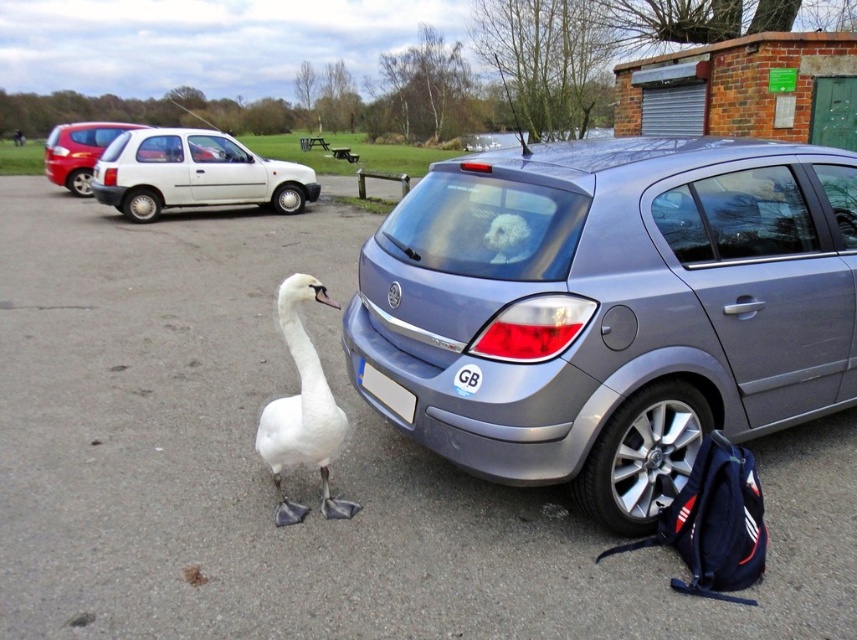
Question: Observing the image, what is the correct spatial positioning of matte red hatchback at left in reference to white plastic license plate at rear?

Choices:
 (A) left
 (B) right

Answer: (A)

Question: Is satin silver car at center thinner than matte red hatchback at left?

Choices:
 (A) yes
 (B) no

Answer: (A)

Question: Which point appears closest to the camera in this image?

Choices:
 (A) (120, 124)
 (B) (682, 289)

Answer: (B)

Question: Among these points, which one is farthest from the camera?

Choices:
 (A) (388, 396)
 (B) (838, 337)
 (C) (280, 435)
 (D) (165, 189)

Answer: (D)

Question: Does white matte hatchback at left appear on the left side of white glossy goose at center?

Choices:
 (A) no
 (B) yes

Answer: (B)

Question: Which object appears closest to the camera in this image?

Choices:
 (A) white plastic license plate at rear
 (B) white matte hatchback at left
 (C) satin silver car at center
 (D) white glossy goose at center

Answer: (C)